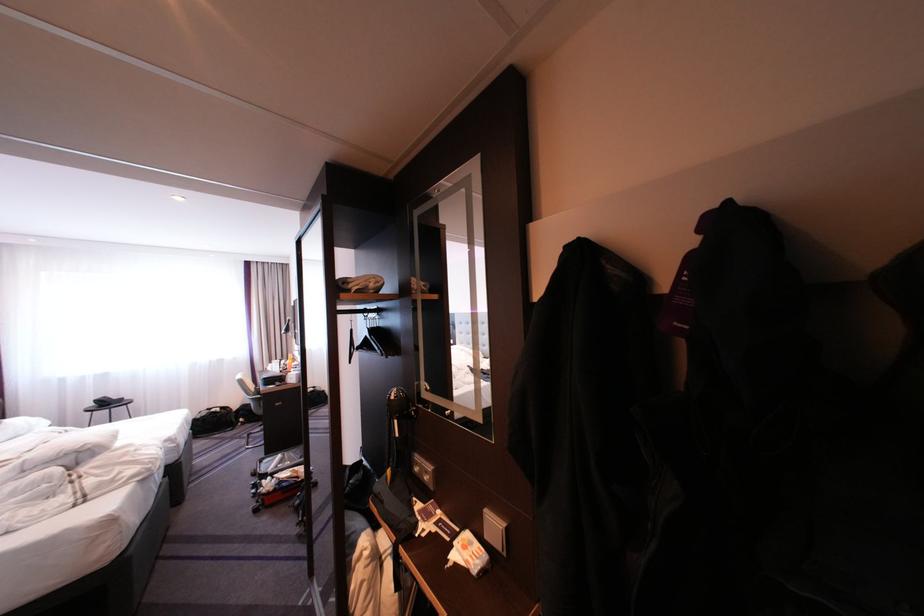
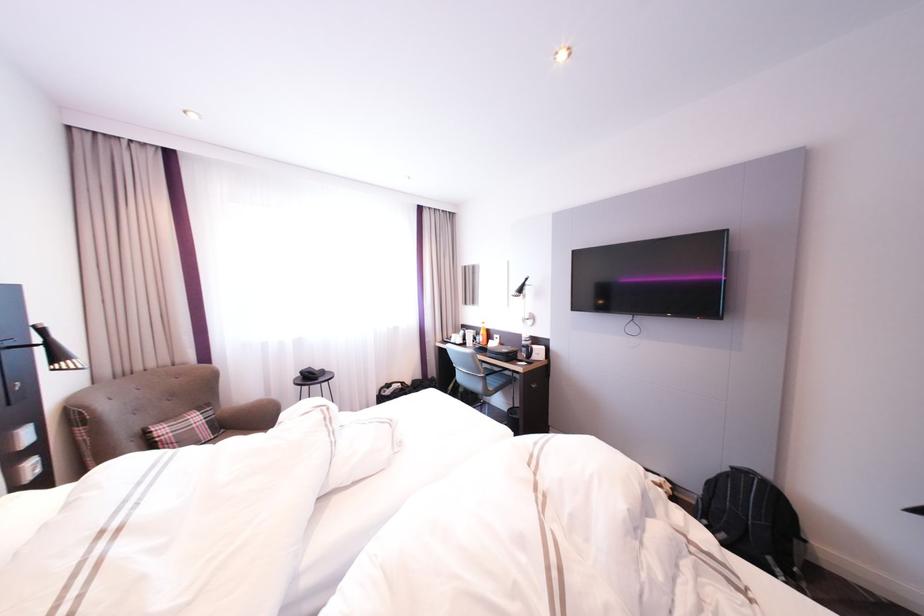
Question: The images are taken continuously from a first-person perspective. In which direction are you moving?

Choices:
 (A) Left
 (B) Right
 (C) Forward
 (D) Backward

Answer: (A)